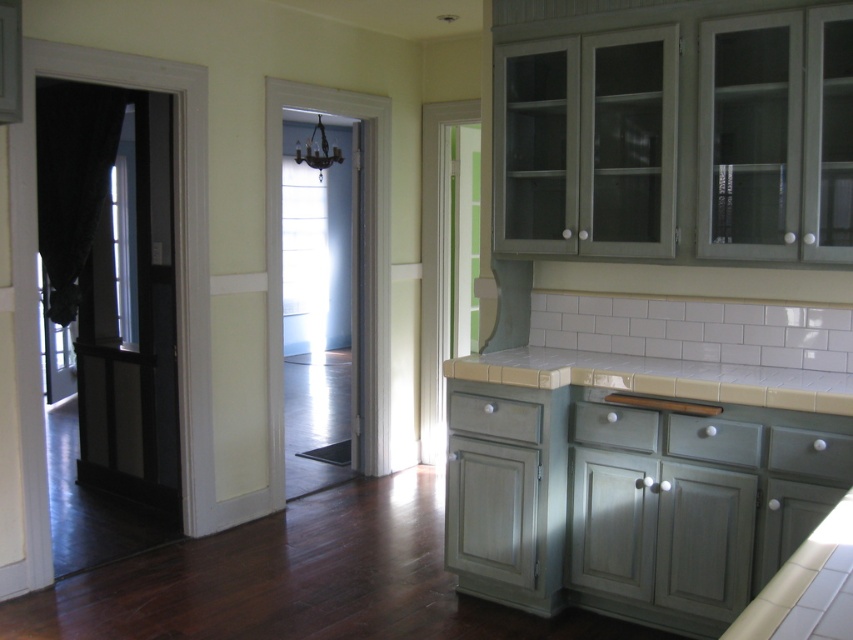
You are a chef preparing a meal in the kitchen shown. You need to place a cutting board on the countertop. Which countertop, the white tile countertop at center or the beige tile countertop at center, is positioned lower and thus more accessible for placing the cutting board?

The white tile countertop at center is located below the beige tile countertop at center, making it more accessible for placing the cutting board.

Looking at this image, you are a chef preparing a meal and need to place a large cutting board on the countertop. Given that the white tile countertop at center and beige tile countertop at center are both available, which one would you choose based on their size?

The white tile countertop at center has a larger size compared to the beige tile countertopt at center, so you should choose the white tile countertop at center to place the large cutting board.